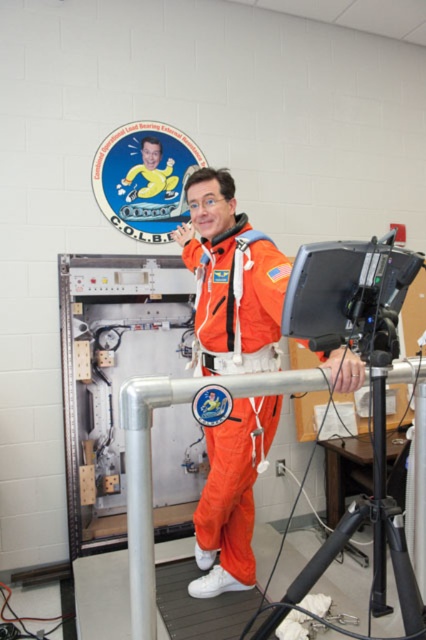
Is orange fabric spacesuit at center below black plastic tripod at lower right?

No, orange fabric spacesuit at center is not below black plastic tripod at lower right.

Can you confirm if orange fabric spacesuit at center is shorter than black plastic tripod at lower right?

In fact, orange fabric spacesuit at center may be taller than black plastic tripod at lower right.

What do you see at coordinates (230, 278) in the screenshot?
I see `orange fabric spacesuit at center` at bounding box center [230, 278].

Identify the location of orange fabric spacesuit at center. The image size is (426, 640). (230, 278).